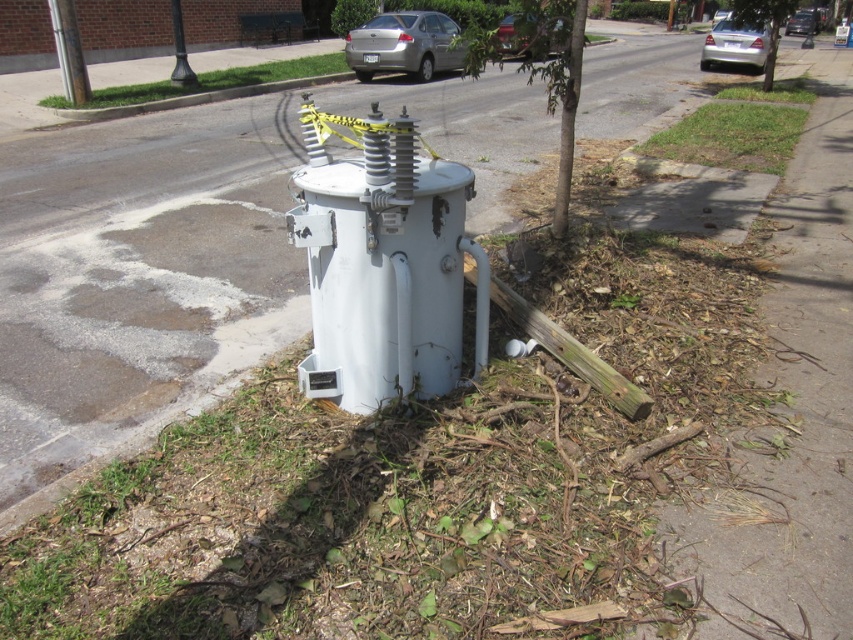
You are a delivery person trying to park your silver metallic car at upper right near the black glossy pole at upper center. Considering their heights, will the car fit under the pole without hitting it?

The silver metallic car at upper right is much taller than the black glossy pole at upper center, so the car will hit the pole if parked under it.

You are a delivery person trying to park your van behind the white matte water heater at center. The metallic silver sedan at upper center is blocking the path. Can you drive around the sedan to access the water heater?

The white matte water heater at center is positioned under the metallic silver sedan at upper center, meaning the sedan is directly above it. This likely blocks any access route from above, so driving around the sedan to reach the water heater might not be feasible unless there is an alternative path not blocked by the sedan.